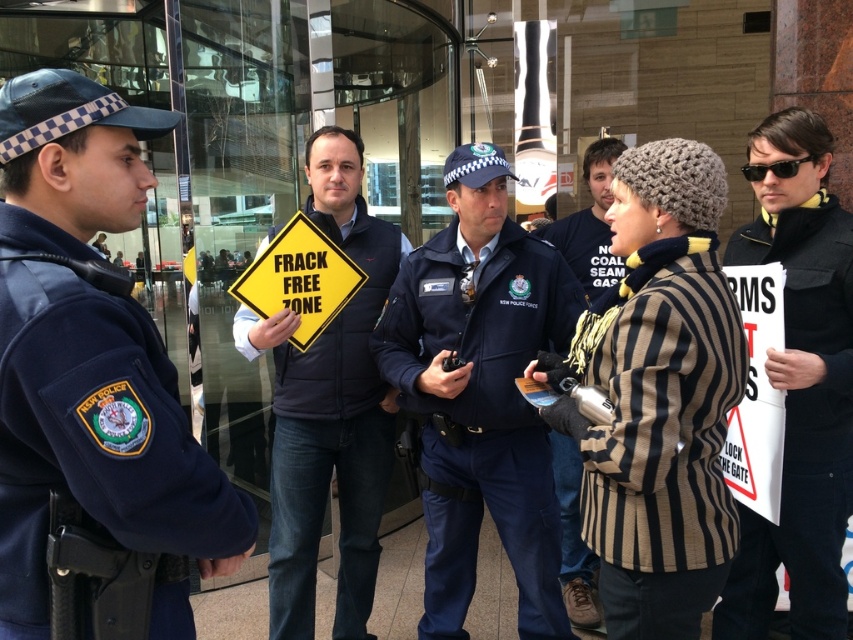
Question: Which point is farther from the camera taking this photo?

Choices:
 (A) (469, 577)
 (B) (608, 276)
 (C) (323, 424)
 (D) (38, 353)

Answer: (B)

Question: Can you confirm if white paper sign at right is positioned to the left of yellow diamond sign at center?

Choices:
 (A) no
 (B) yes

Answer: (A)

Question: Which is farther from the navy blue uniform at left?

Choices:
 (A) yellow diamond sign at center
 (B) dark blue uniform at center

Answer: (A)

Question: Considering the real-world distances, which object is closest to the navy blue uniform at left?

Choices:
 (A) white paper sign at right
 (B) striped woolen sweater at center
 (C) dark blue uniform at center
 (D) yellow diamond sign at center

Answer: (C)

Question: Is white paper sign at right bigger than yellow diamond sign at center?

Choices:
 (A) yes
 (B) no

Answer: (B)

Question: Considering the relative positions of white paper sign at right and striped woolen sweater at center in the image provided, where is white paper sign at right located with respect to striped woolen sweater at center?

Choices:
 (A) left
 (B) right

Answer: (B)